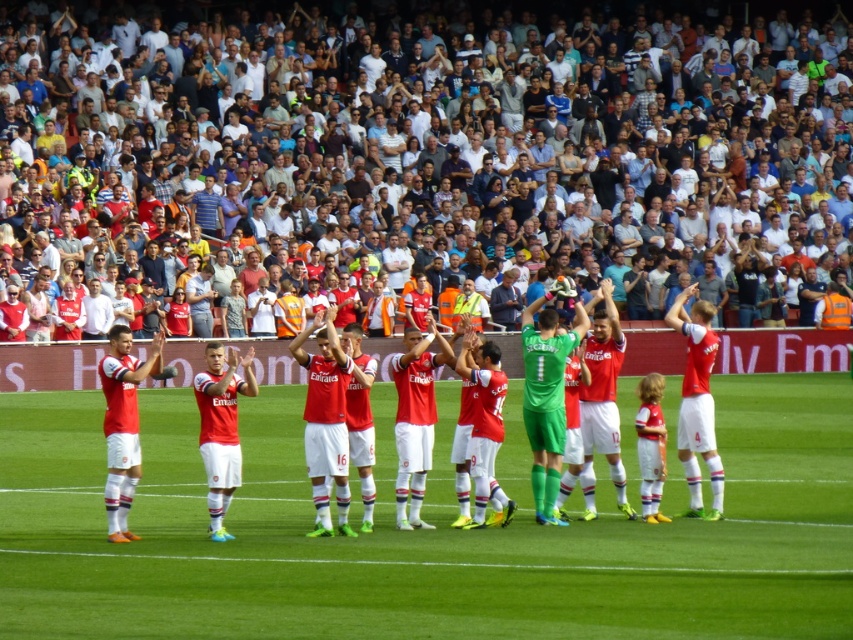
You are standing at the point marked as point (407, 541) in the football stadium. You want to take a photo of the crowd in the background. Is the crowd in the background far enough from you to fit in the photo?

The distance of point (407, 541) from viewer is 17.88 meters. Since the crowd is in the background, they are likely further away than 17.88 meters, so they should be far enough to fit in the photo.